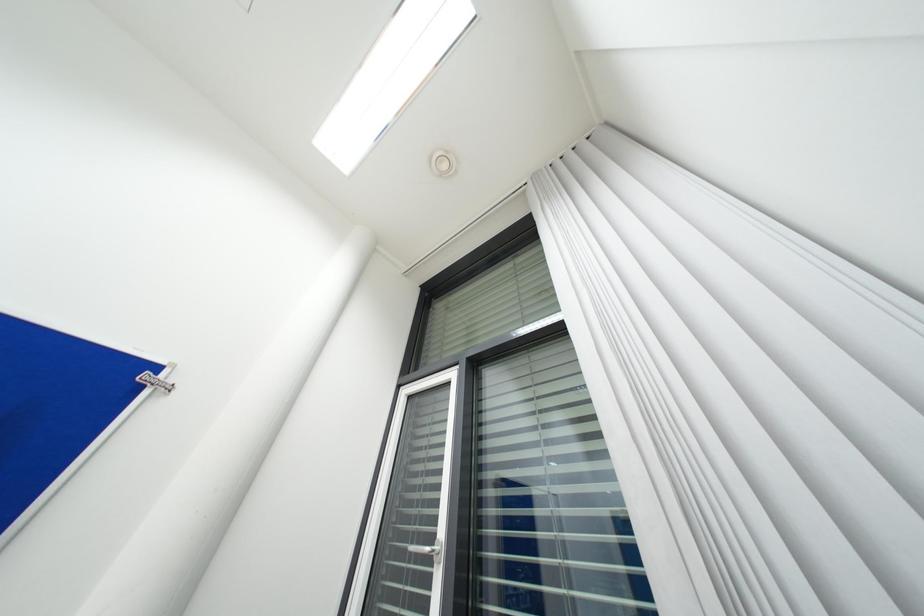
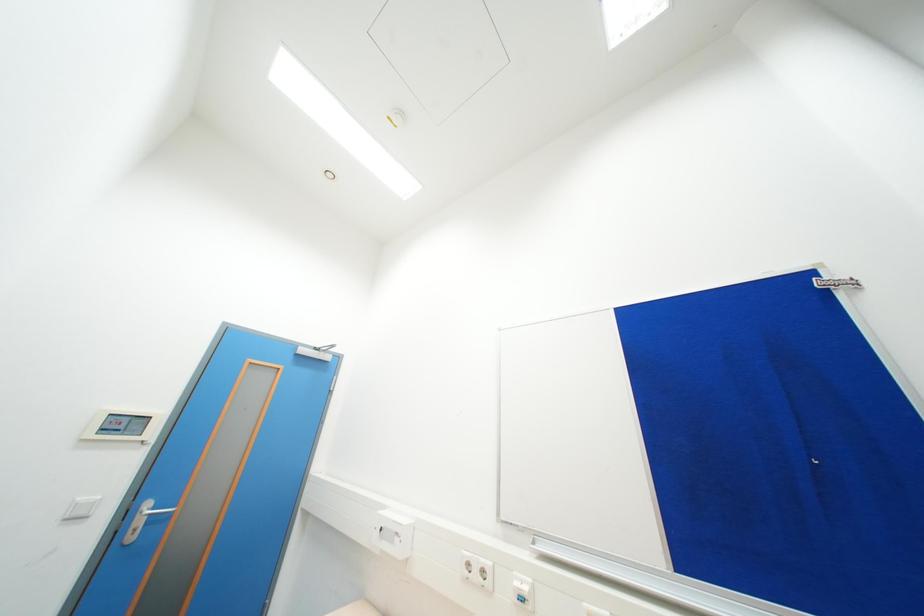
How did the camera likely rotate?

The camera's rotation is toward left-up.